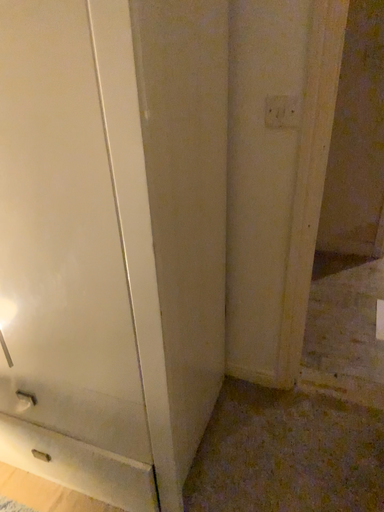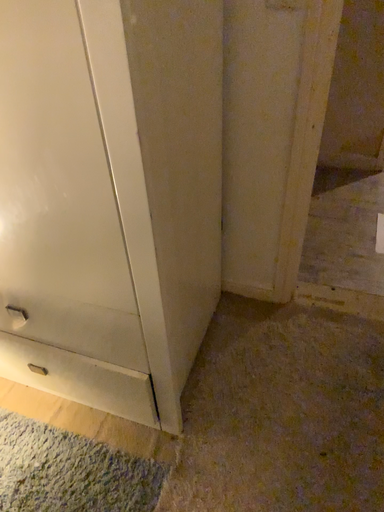
Question: Which way did the camera rotate in the video?

Choices:
 (A) rotated downward
 (B) rotated upward

Answer: (A)